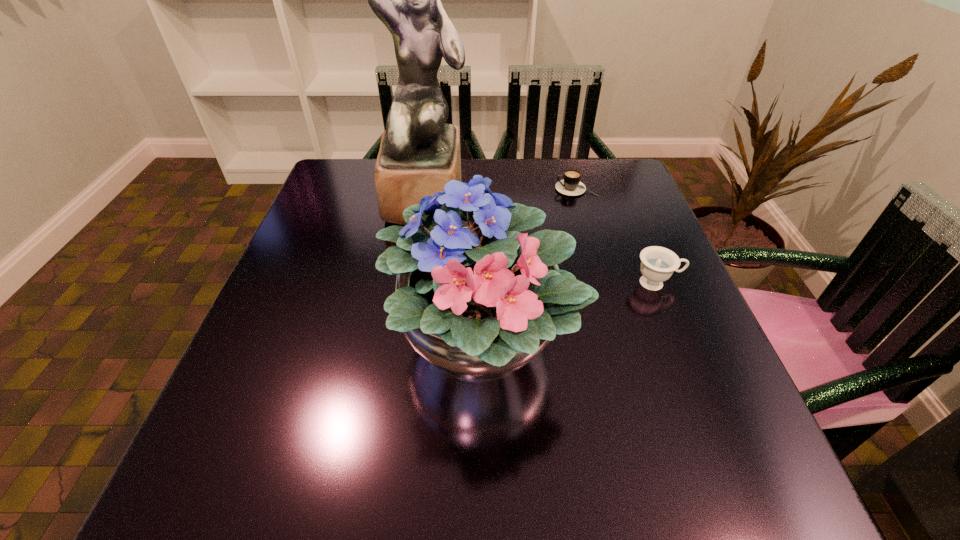
In order to click on vacant area at the near right corner in this screenshot , I will do `click(697, 487)`.

Image resolution: width=960 pixels, height=540 pixels. Find the location of `unoccupied area between the teacup and the shortest object`. unoccupied area between the teacup and the shortest object is located at coordinates (616, 236).

Where is `vacant space that's between the shortest object and the tallest object`? The width and height of the screenshot is (960, 540). vacant space that's between the shortest object and the tallest object is located at coordinates (x=501, y=194).

Where is `free space between the third object from left to right and the rightmost object`? The width and height of the screenshot is (960, 540). free space between the third object from left to right and the rightmost object is located at coordinates (616, 236).

The width and height of the screenshot is (960, 540). I want to click on free space that is in between the second shortest object and the third object from left to right, so click(616, 236).

Point out which object is positioned as the second nearest to the bouquet. Please provide its 2D coordinates. Your answer should be formatted as a tuple, i.e. [(x, y)], where the tuple contains the x and y coordinates of a point satisfying the conditions above.

[(419, 153)]

Identify the location of object that is the third nearest to the third shortest object. This screenshot has height=540, width=960. (571, 185).

Identify the location of vacant space that satisfies the following two spatial constraints: 1. with the handle on the side of the shortest object; 2. in a relaxed pose on the tallest object. Image resolution: width=960 pixels, height=540 pixels. (579, 199).

The width and height of the screenshot is (960, 540). In order to click on free spot that satisfies the following two spatial constraints: 1. in a relaxed pose on the sculpture; 2. on the left side of the second tallest object in this screenshot , I will do `click(404, 341)`.

Locate an element on the screen. Image resolution: width=960 pixels, height=540 pixels. vacant region that satisfies the following two spatial constraints: 1. with the handle on the side of the cappuccino; 2. in a relaxed pose on the tallest object is located at coordinates (579, 199).